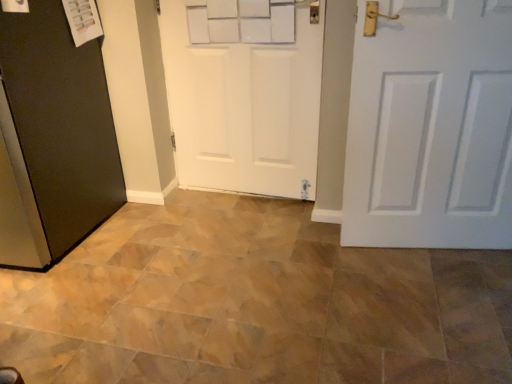
Question: Does white matte door at center, the 2th door positioned from the right, appear on the right side of black matte door at left, which appears as the 3th door when viewed from the right?

Choices:
 (A) yes
 (B) no

Answer: (A)

Question: Is white matte door at center, the 2th door positioned from the right, looking in the opposite direction of black matte door at left, which appears as the 3th door when viewed from the right?

Choices:
 (A) yes
 (B) no

Answer: (B)

Question: From a real-world perspective, does white matte door at center, the 2th door positioned from the right, sit lower than black matte door at left, placed as the first door when sorted from left to right?

Choices:
 (A) no
 (B) yes

Answer: (A)

Question: Are white matte door at center, positioned as the second door in left-to-right order, and black matte door at left, which appears as the 3th door when viewed from the right, making contact?

Choices:
 (A) yes
 (B) no

Answer: (B)

Question: Could you tell me if white matte door at center, positioned as the second door in left-to-right order, is facing black matte door at left, which appears as the 3th door when viewed from the right?

Choices:
 (A) yes
 (B) no

Answer: (B)

Question: Is black matte door at left, placed as the first door when sorted from left to right, inside white matte door at center, positioned as the second door in left-to-right order?

Choices:
 (A) yes
 (B) no

Answer: (B)

Question: Is white matte door at center, positioned as the second door in left-to-right order, completely or partially inside brown ceramic tile at center?

Choices:
 (A) yes
 (B) no

Answer: (B)

Question: From a real-world perspective, is brown ceramic tile at center positioned over white matte door at center, positioned as the second door in left-to-right order, based on gravity?

Choices:
 (A) yes
 (B) no

Answer: (B)

Question: Can you confirm if brown ceramic tile at center is taller than white matte door at center, positioned as the second door in left-to-right order?

Choices:
 (A) no
 (B) yes

Answer: (A)

Question: From a real-world perspective, is brown ceramic tile at center beneath white matte door at center, positioned as the second door in left-to-right order?

Choices:
 (A) yes
 (B) no

Answer: (A)

Question: Does brown ceramic tile at center have a lesser height compared to white matte door at center, the 2th door positioned from the right?

Choices:
 (A) yes
 (B) no

Answer: (A)

Question: From the image's perspective, is brown ceramic tile at center located above white matte door at center, the 2th door positioned from the right?

Choices:
 (A) no
 (B) yes

Answer: (A)

Question: Is white matte door at center, positioned as the second door in left-to-right order, located outside white matte door at center, which is the 3th door from left to right?

Choices:
 (A) yes
 (B) no

Answer: (A)